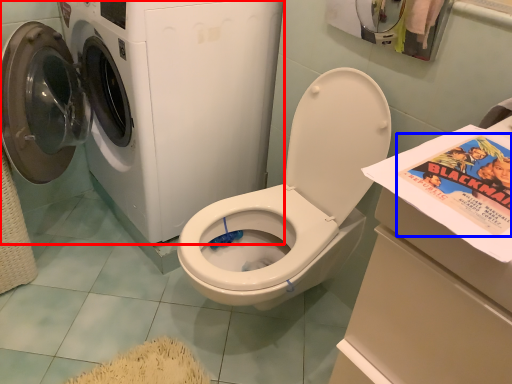
Question: Which point is further to the camera, washing machine (highlighted by a red box) or comic book (highlighted by a blue box)?

Choices:
 (A) washing machine
 (B) comic book

Answer: (A)